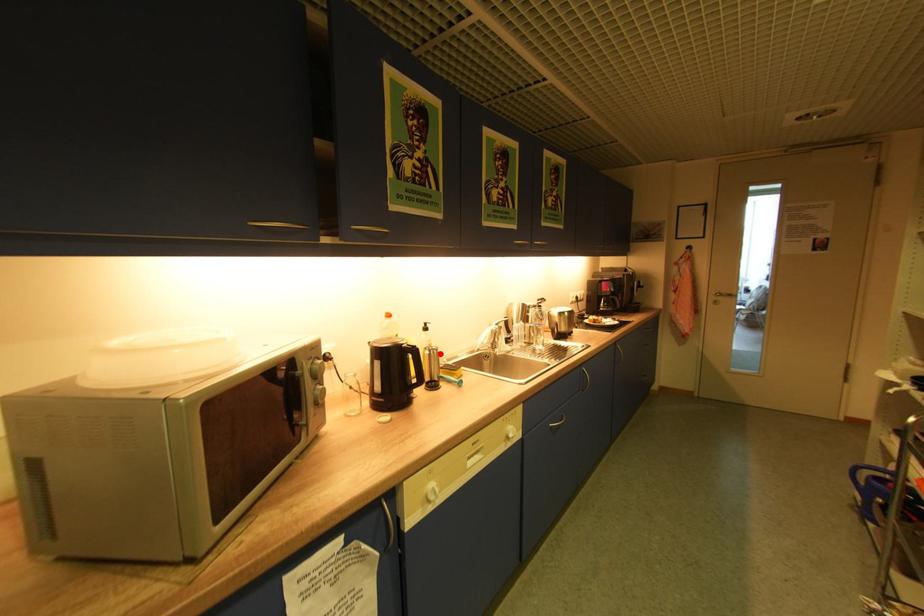
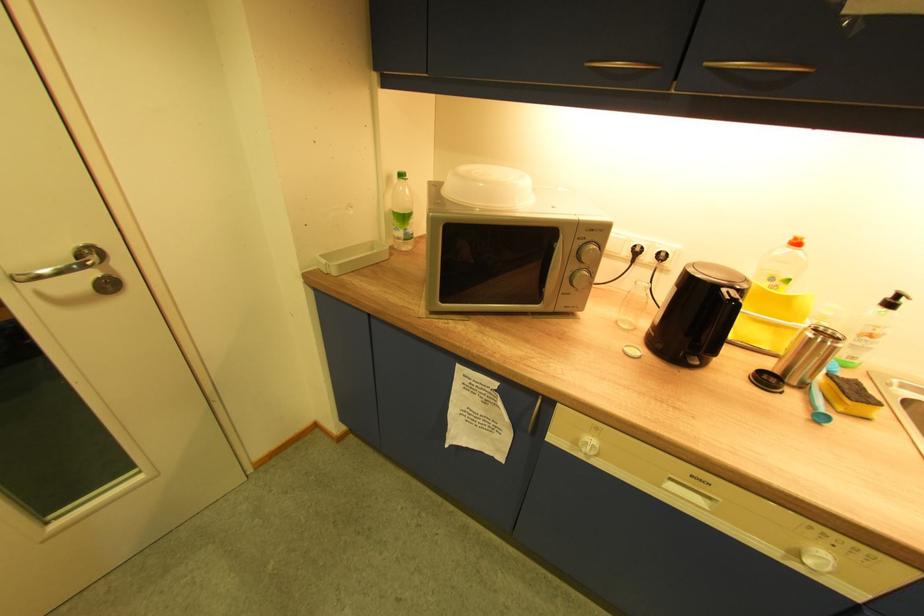
Locate, in the second image, the point that corresponds to the highlighted location in the first image.

(830, 342)